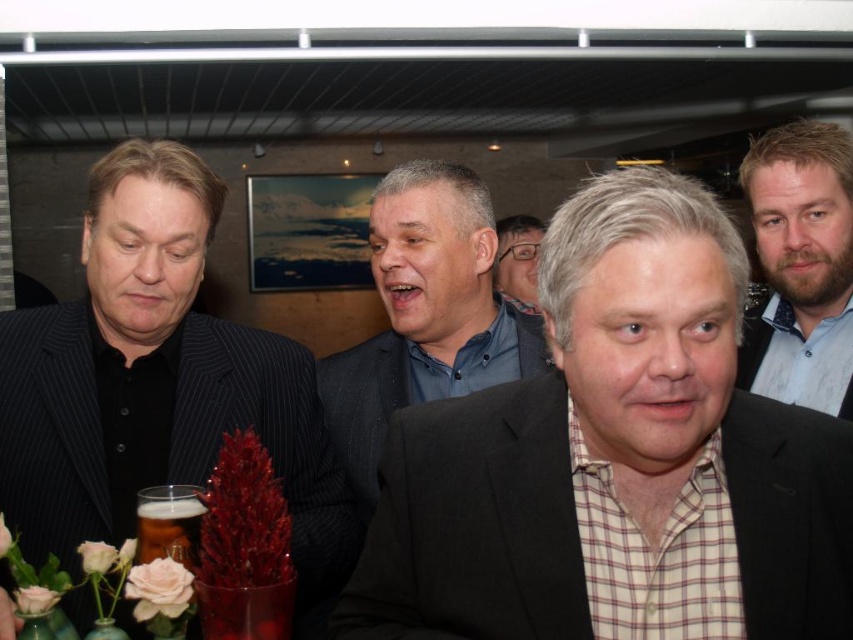
You are a photographer trying to capture a candid shot of the bearded man at center and the gray matte suit at center. Since you want to ensure both subjects are in frame, can you determine if they are positioned side by side or if one is behind the other?

The gray matte suit at center is positioned on the left side of bearded man at center, so they are positioned side by side.

You are a bartender who needs to place a new drink order. You see the translucent glass beer at lower left and the matte black glasses at center. Which object is positioned lower in the image?

The translucent glass beer at lower left is positioned below the matte black glasses at center, so it is lower in the image.

You are a waiter in a crowded bar. You need to deliver a drink to the customer at point (167, 524). What is the drink you should bring?

The drink you should bring is the translucent glass beer at lower left located at point (167, 524).